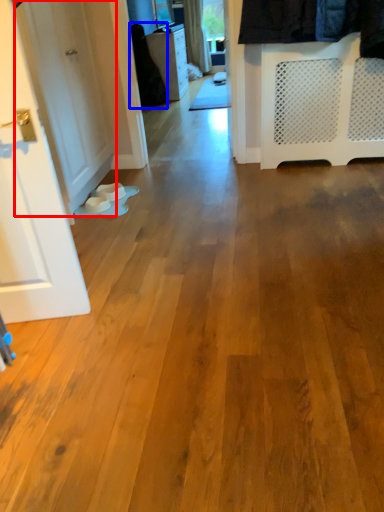
Question: Among these objects, which one is nearest to the camera, door (highlighted by a red box) or clothing (highlighted by a blue box)?

Choices:
 (A) door
 (B) clothing

Answer: (A)